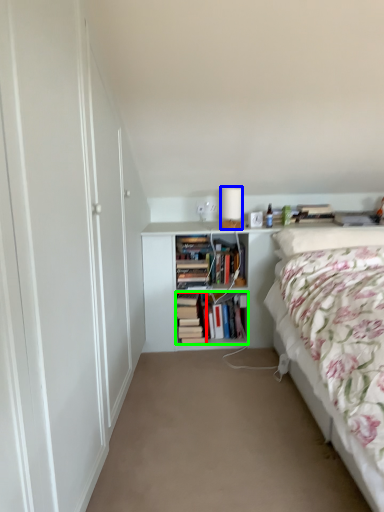
Question: Based on their relative distances, which object is farther from book (highlighted by a red box)? Choose from table lamp (highlighted by a blue box) and book (highlighted by a green box).

Choices:
 (A) table lamp
 (B) book

Answer: (A)